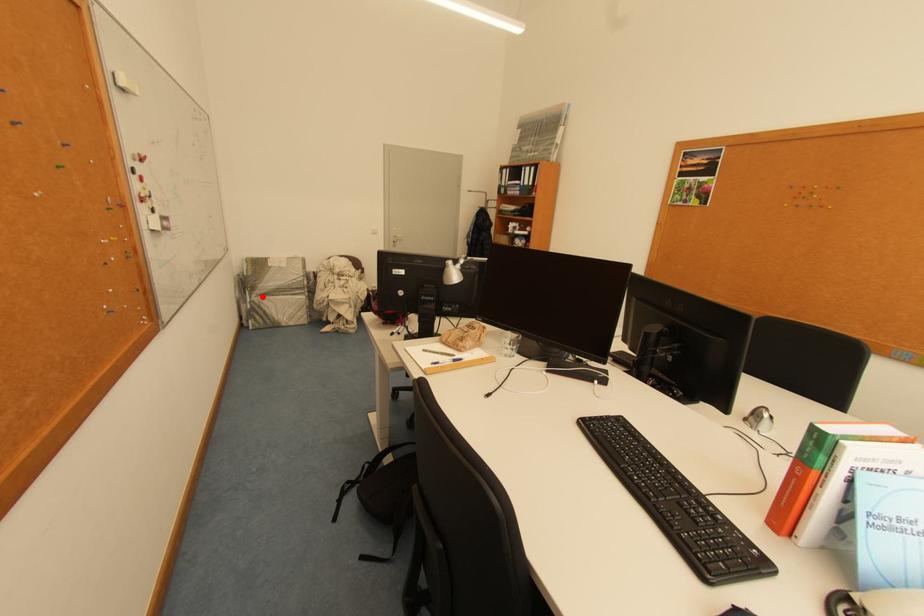
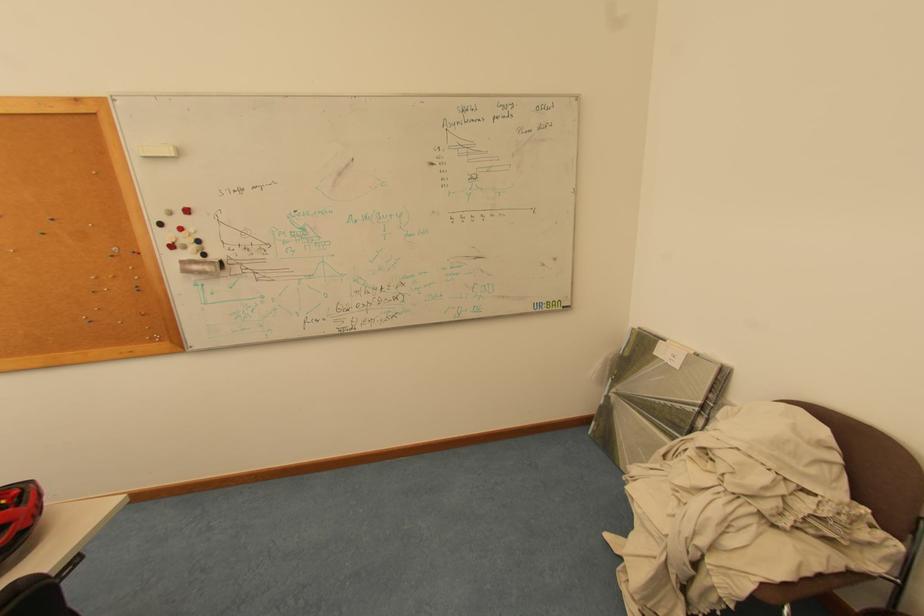
The point at the highlighted location is marked in the first image. Where is the corresponding point in the second image?

(622, 392)